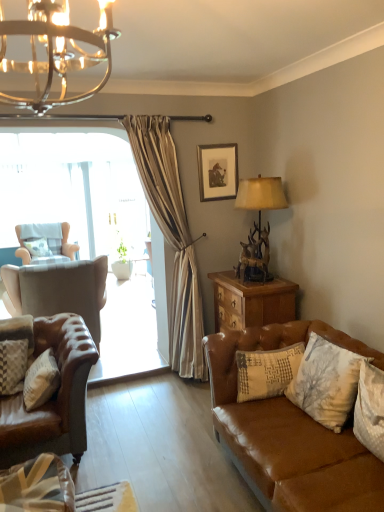
Question: Is leather armchair at left, the second chair in the back-to-front sequence, to the right of patterned fabric pillow at left, which is the 1th pillow in back-to-front order, from the viewer's perspective?

Choices:
 (A) no
 (B) yes

Answer: (B)

Question: Is leather armchair at left, which ranks as the 1th chair in front-to-back order, smaller than patterned fabric pillow at left, which is the 1th pillow in back-to-front order?

Choices:
 (A) no
 (B) yes

Answer: (A)

Question: Is the depth of leather armchair at left, which appears as the first chair when viewed from the right, greater than that of patterned fabric pillow at left, marked as the fifth pillow in a front-to-back arrangement?

Choices:
 (A) no
 (B) yes

Answer: (A)

Question: From a real-world perspective, is leather armchair at left, which appears as the first chair when viewed from the right, located higher than patterned fabric pillow at left, marked as the fifth pillow in a front-to-back arrangement?

Choices:
 (A) no
 (B) yes

Answer: (A)

Question: Is leather armchair at left, the second chair in the back-to-front sequence, to the left of patterned fabric pillow at left, marked as the fifth pillow in a front-to-back arrangement, from the viewer's perspective?

Choices:
 (A) yes
 (B) no

Answer: (B)

Question: Is leather armchair at left, which appears as the first chair when viewed from the right, positioned before patterned fabric pillow at left, marked as the fifth pillow in a front-to-back arrangement?

Choices:
 (A) yes
 (B) no

Answer: (A)

Question: Is white textured pillow at lower right, which is the second pillow in front-to-back order, aimed at textured beige pillow at center right, acting as the third pillow starting from the left?

Choices:
 (A) yes
 (B) no

Answer: (B)

Question: Is white textured pillow at lower right, arranged as the 5th pillow when viewed from the left, far from textured beige pillow at center right, which is the fourth pillow in front-to-back order?

Choices:
 (A) no
 (B) yes

Answer: (A)

Question: Is white textured pillow at lower right, arranged as the 5th pillow when viewed from the left, to the left of textured beige pillow at center right, acting as the third pillow starting from the right, from the viewer's perspective?

Choices:
 (A) yes
 (B) no

Answer: (B)

Question: Is white textured pillow at lower right, arranged as the 5th pillow when viewed from the left, positioned with its back to textured beige pillow at center right, acting as the third pillow starting from the right?

Choices:
 (A) yes
 (B) no

Answer: (B)

Question: Does white textured pillow at lower right, the 1th pillow when ordered from right to left, have a smaller size compared to textured beige pillow at center right, acting as the third pillow starting from the left?

Choices:
 (A) yes
 (B) no

Answer: (A)

Question: From a real-world perspective, is white textured pillow at lower right, the 1th pillow when ordered from right to left, located higher than textured beige pillow at center right, acting as the third pillow starting from the right?

Choices:
 (A) no
 (B) yes

Answer: (B)

Question: Is leather armchair at left, which ranks as the 1th chair in front-to-back order, closer to the viewer compared to white textured pillow at lower right, which is the second pillow in front-to-back order?

Choices:
 (A) yes
 (B) no

Answer: (B)